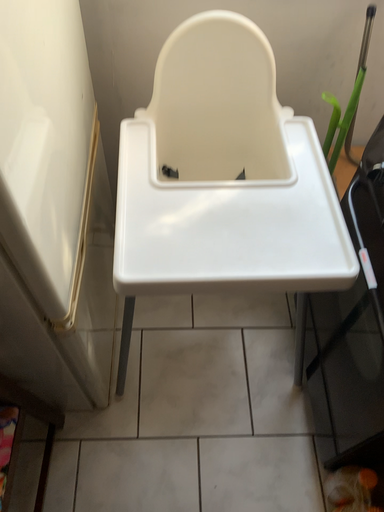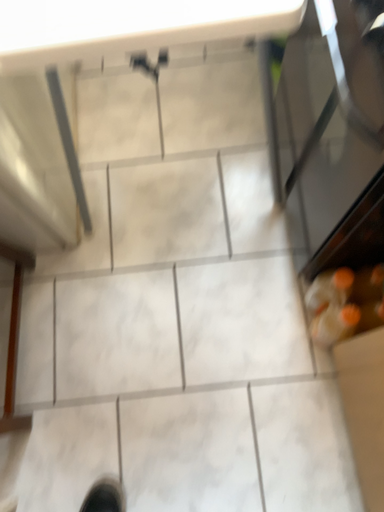
Question: How did the camera likely rotate when shooting the video?

Choices:
 (A) rotated upward
 (B) rotated downward

Answer: (B)